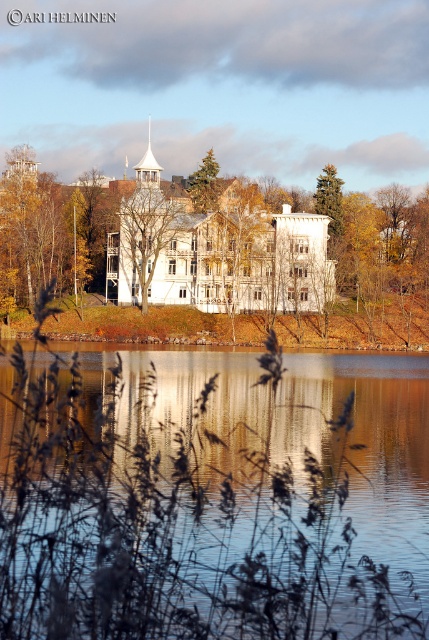
Which is more to the right, transparent water at center or green matte tree at upper center?

Positioned to the right is transparent water at center.

Can you confirm if transparent water at center is smaller than green matte tree at upper center?

No, transparent water at center is not smaller than green matte tree at upper center.

Between point (272, 516) and point (214, 209), which one is positioned in front?

Positioned in front is point (272, 516).

The height and width of the screenshot is (640, 429). In order to click on transparent water at center in this screenshot , I will do tap(175, 525).

Is brown textured tree at center closer to the viewer compared to green matte tree at upper center?

Yes, it is.

What do you see at coordinates (148, 234) in the screenshot?
I see `brown textured tree at center` at bounding box center [148, 234].

The image size is (429, 640). What are the coordinates of `brown textured tree at center` in the screenshot? It's located at (148, 234).

Between transparent water at center and yellow/golden leaves at center, which one has less height?

transparent water at center

Is transparent water at center smaller than yellow/golden leaves at center?

Indeed, transparent water at center has a smaller size compared to yellow/golden leaves at center.

I want to click on transparent water at center, so click(x=175, y=525).